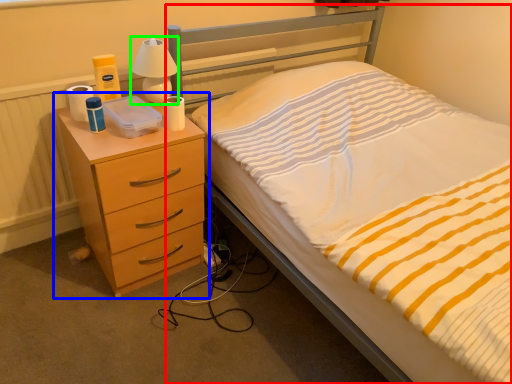
Question: Which object is the farthest from bed (highlighted by a red box)? Choose among these: chest of drawers (highlighted by a blue box) or bedside lamp (highlighted by a green box).

Choices:
 (A) chest of drawers
 (B) bedside lamp

Answer: (B)